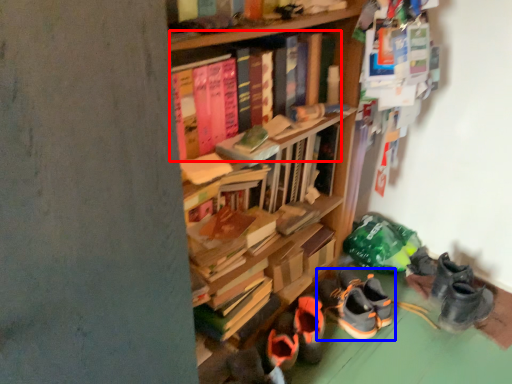
Question: Among these objects, which one is nearest to the camera, book (highlighted by a red box) or footwear (highlighted by a blue box)?

Choices:
 (A) book
 (B) footwear

Answer: (A)